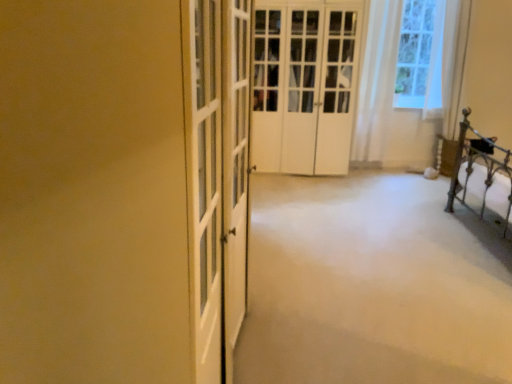
You are a GUI agent. You are given a task and a screenshot of the screen. Output one action in this format:
    pyautogui.click(x=<x>, y=<y>)
    Task: Click on the free spot in front of white matte door at center
    
    Given the screenshot: What is the action you would take?
    pyautogui.click(x=316, y=195)